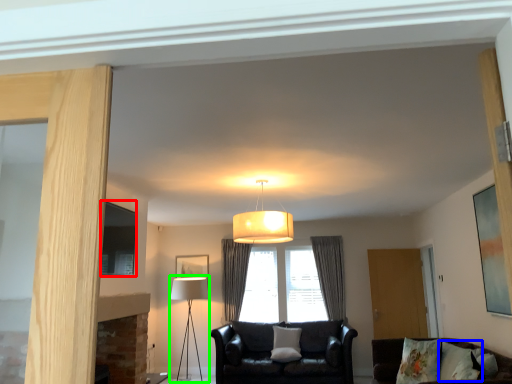
Question: Estimate the real-world distances between objects in this image. Which object is farther from picture frame (highlighted by a red box), pillow (highlighted by a blue box) or table lamp (highlighted by a green box)?

Choices:
 (A) pillow
 (B) table lamp

Answer: (A)